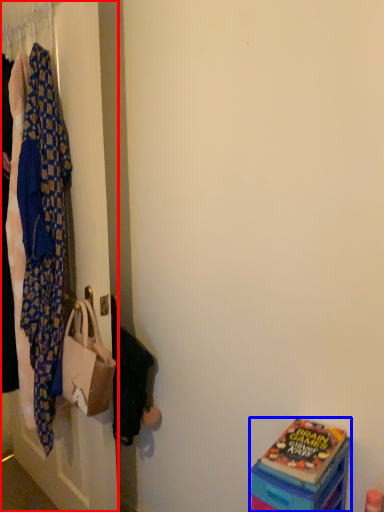
Question: Which object appears closest to the camera in this image, closet (highlighted by a red box) or box (highlighted by a blue box)?

Choices:
 (A) closet
 (B) box

Answer: (B)